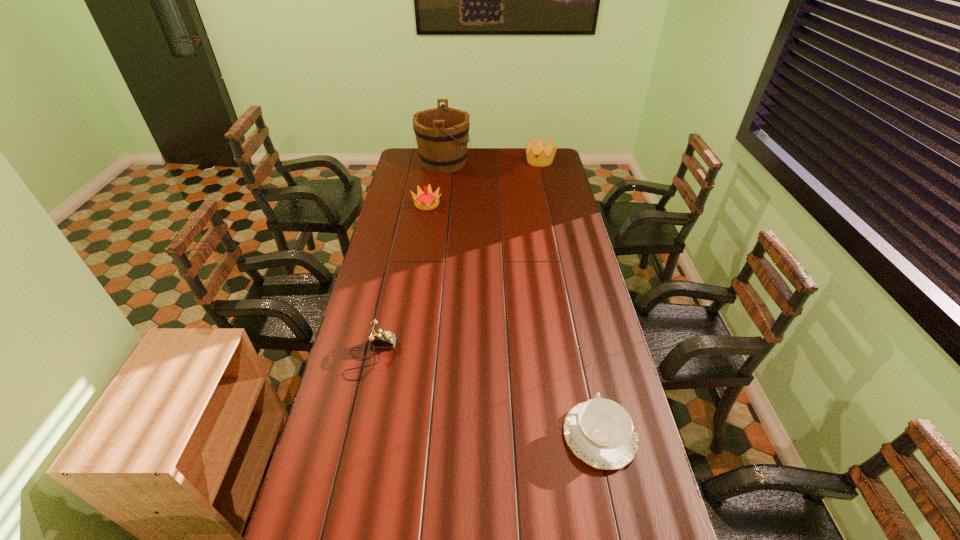
Find the location of a particular element. This screenshot has width=960, height=540. vacant space that's between the left crown and the right crown is located at coordinates (484, 183).

Identify the location of free area in between the wine bucket and the telephone. Image resolution: width=960 pixels, height=540 pixels. (407, 259).

This screenshot has height=540, width=960. In order to click on vacant region between the nearer crown and the tallest object in this screenshot , I will do `click(435, 183)`.

The width and height of the screenshot is (960, 540). Find the location of `free space between the left crown and the telephone`. free space between the left crown and the telephone is located at coordinates (399, 280).

Locate an element on the screen. The height and width of the screenshot is (540, 960). empty space that is in between the third nearest object and the wine bucket is located at coordinates (435, 183).

Where is `object that can be found as the second closest to the left crown`? The height and width of the screenshot is (540, 960). object that can be found as the second closest to the left crown is located at coordinates (546, 153).

Identify which object is the nearest to the chinaware. Please provide its 2D coordinates. Your answer should be formatted as a tuple, i.e. [(x, y)], where the tuple contains the x and y coordinates of a point satisfying the conditions above.

[(379, 338)]

The image size is (960, 540). Identify the location of vacant space that satisfies the following two spatial constraints: 1. on the handle side of the nearest object; 2. on the dial of the telephone. (583, 356).

Identify the location of vacant space that satisfies the following two spatial constraints: 1. on the handle side of the chinaware; 2. on the dial of the telephone. (583, 356).

Locate an element on the screen. vacant space that satisfies the following two spatial constraints: 1. on the dial of the second nearest object; 2. on the handle side of the nearest object is located at coordinates (352, 436).